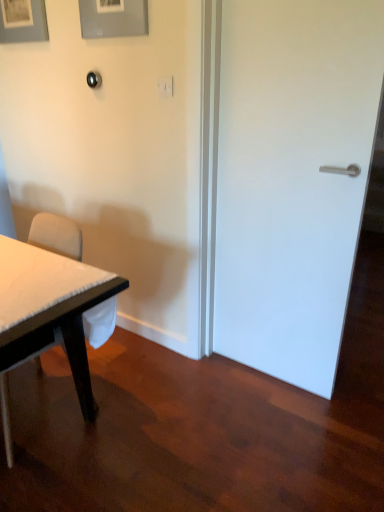
Locate an element on the screen. Image resolution: width=384 pixels, height=512 pixels. vacant area that is situated to the right of white matte door at right is located at coordinates (345, 397).